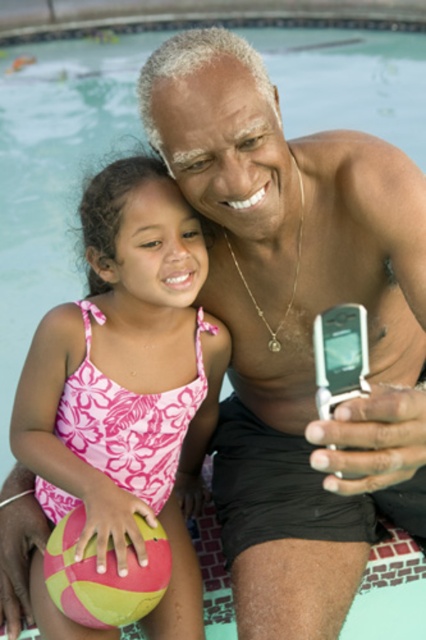
Is point (94, 333) positioned after point (158, 528)?

Yes.

Who is taller, pink floral swimsuit at center or multicolored rubber ball at lower left?

pink floral swimsuit at center is taller.

This screenshot has width=426, height=640. Describe the element at coordinates (129, 380) in the screenshot. I see `pink floral swimsuit at center` at that location.

Identify the location of pink floral swimsuit at center. (129, 380).